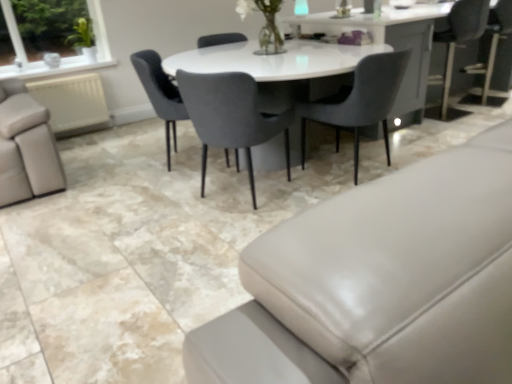
In order to click on free point below matte gray chair at center, which appears as the first chair when viewed from the left (from a real-world perspective) in this screenshot , I will do `click(183, 161)`.